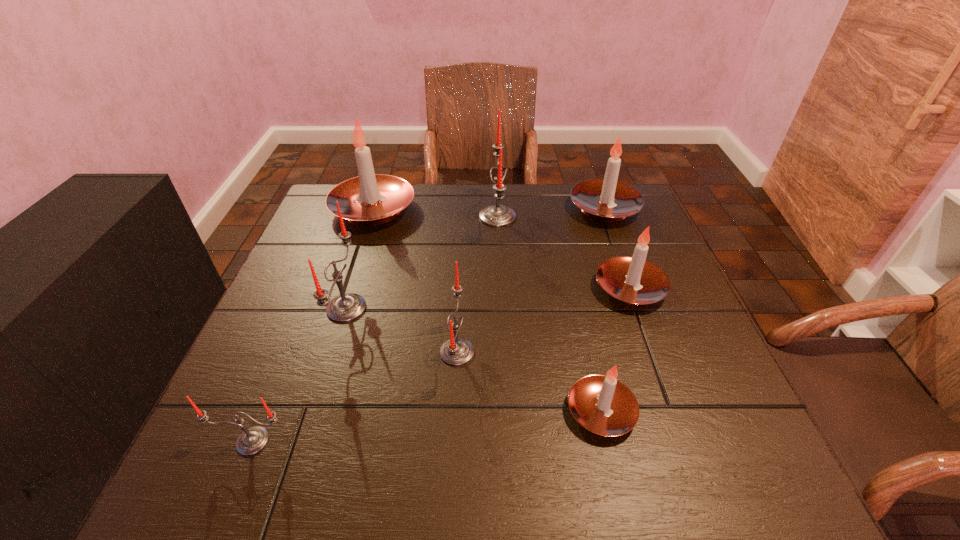
The height and width of the screenshot is (540, 960). What are the coordinates of `the biggest white candle` in the screenshot? It's located at (370, 199).

Identify the location of the farthest red candle. (497, 215).

In order to click on the biggest red candle in this screenshot , I will do `click(497, 215)`.

I want to click on the third smallest white candle, so click(x=608, y=200).

Where is `the third smallest red candle`? The height and width of the screenshot is (540, 960). the third smallest red candle is located at coordinates (346, 307).

Image resolution: width=960 pixels, height=540 pixels. I want to click on the third farthest white candle, so click(x=633, y=280).

This screenshot has height=540, width=960. Identify the location of the second smallest red candle. [x=456, y=351].

Locate an element on the screen. the fourth candle from left to right is located at coordinates (456, 351).

The image size is (960, 540). In order to click on the smallest white candle in this screenshot , I will do `click(603, 405)`.

Find the location of `the nearest red candle`. the nearest red candle is located at coordinates (252, 440).